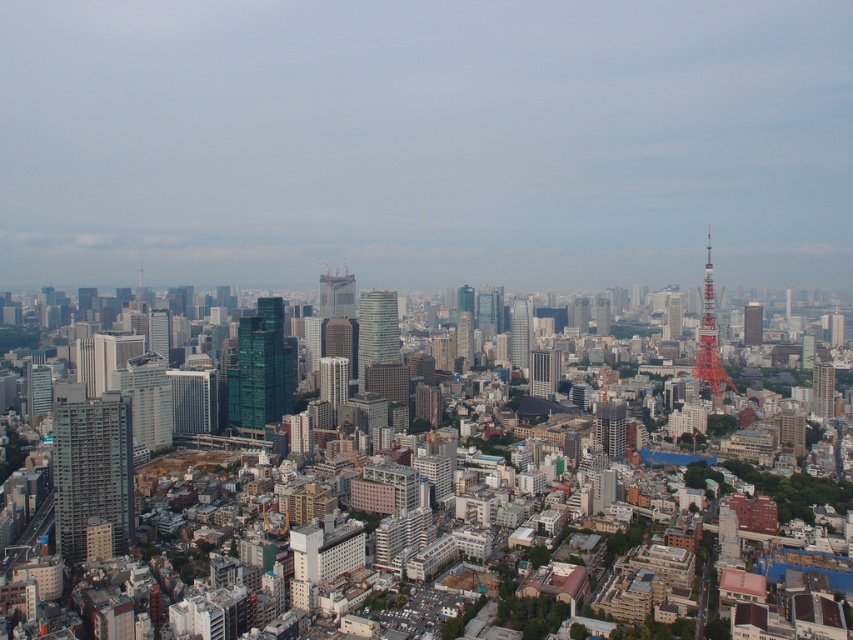
You are a drone operator tasked with navigating between two landmarks in the city. You need to fly from the metallic glass building at left to the glassy skyscraper at center. Based on the scene description, which direction should you steer the drone to reach the destination?

The metallic glass building at left is to the left of the glassy skyscraper at center, so you should steer the drone to the right to reach the glassy skyscraper at center from the metallic glass building at left.

You are a city planner assessing the urban layout. Given the metallic glass building at left and the glassy skyscraper at center, which one has a greater width according to the city blueprint?

The metallic glass building at left has a greater width than the glassy skyscraper at center.